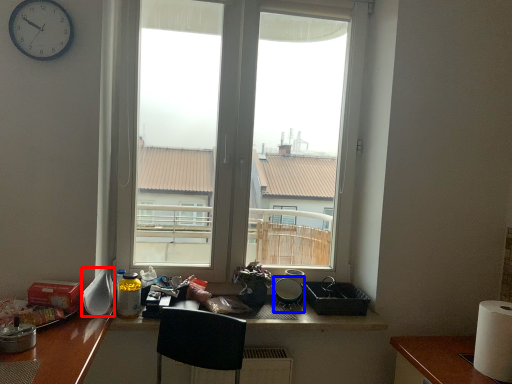
Question: Which object appears closest to the camera in this image, appliance (highlighted by a red box) or appliance (highlighted by a blue box)?

Choices:
 (A) appliance
 (B) appliance

Answer: (A)